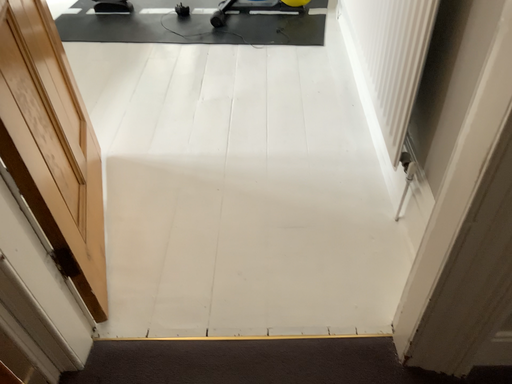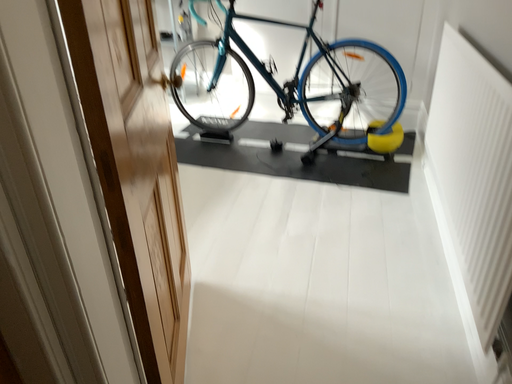
Question: Which way did the camera rotate in the video?

Choices:
 (A) rotated left
 (B) rotated right

Answer: (A)